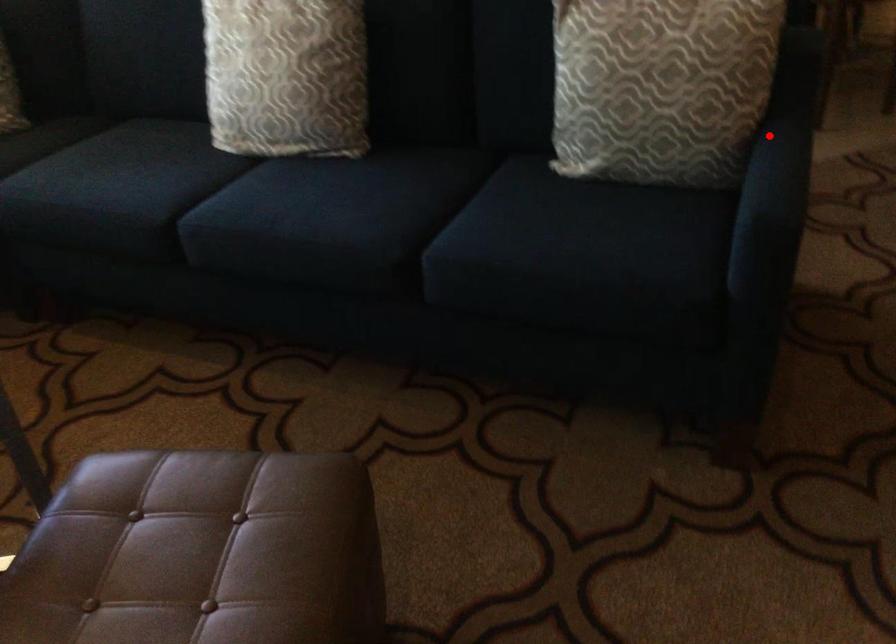
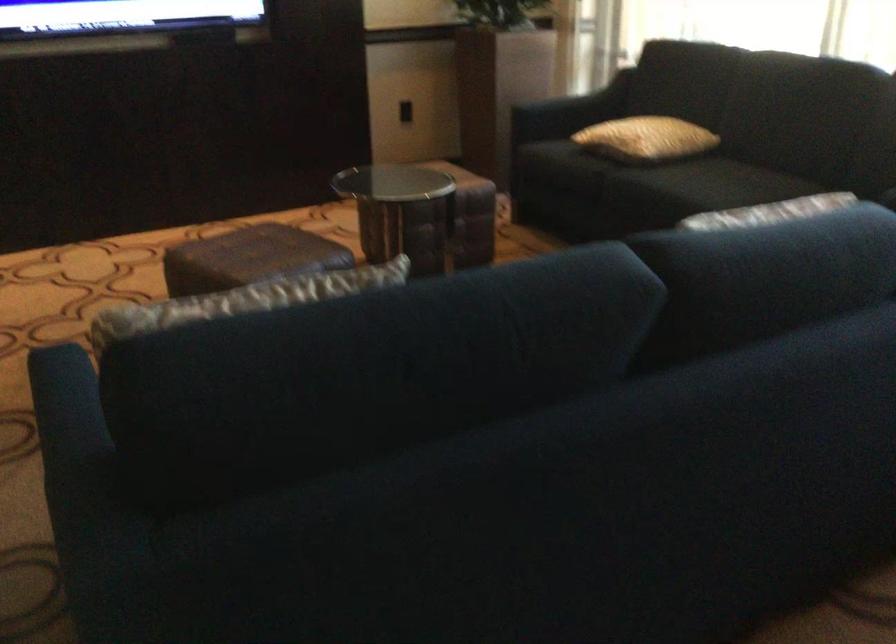
Question: I am providing you with two images of the same scene from different viewpoints. Image1 has a red point marked. In image2, the corresponding 3D location appears at what relative position? Reply with the corresponding letter.

Choices:
 (A) Closer
 (B) Farther

Answer: (A)